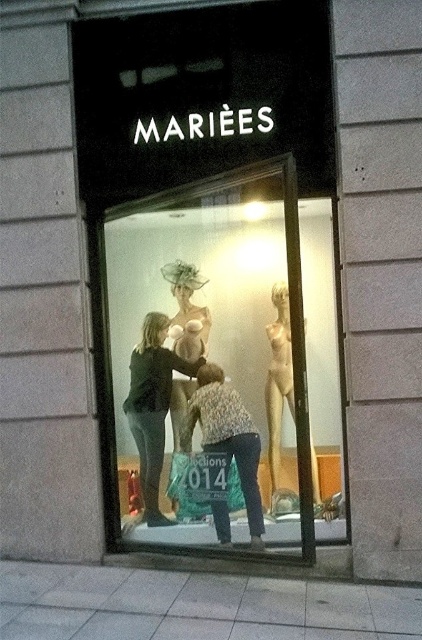
You are a customer standing outside the bridal shop window. You see the dark green fabric dress at center displayed in the window. Can you estimate its exact position using coordinates?

The dark green fabric dress at center is located at coordinates point (153, 406).

You are a customer standing outside the bridal shop window. You notice two dresses displayed inside. Which dress is closer to you, the transparent glass mannequin at center or the dark green fabric dress at center?

The transparent glass mannequin at center is closer to you because it is positioned in front of the dark green fabric dress at center.

You are a customer standing outside the bridal shop window. You notice two items displayed at the center of the window. Which one is larger in size between the transparent glass mannequin at center and the patterned fabric blouse at center?

The transparent glass mannequin at center is bigger than the patterned fabric blouse at center.